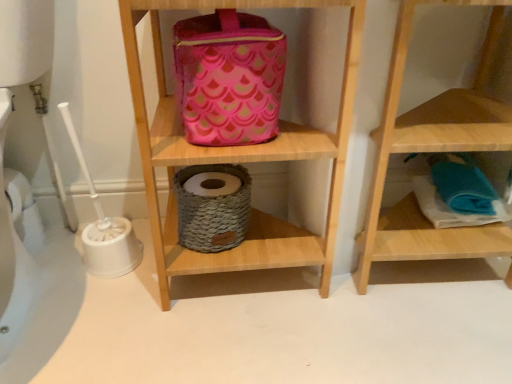
Question: Is pink fabric pouch at upper center closer to the viewer compared to pink fabric bag at upper center, arranged as the 1th shelf when viewed from the left?

Choices:
 (A) no
 (B) yes

Answer: (A)

Question: Is pink fabric pouch at upper center oriented towards pink fabric bag at upper center, the 2th shelf viewed from the right?

Choices:
 (A) yes
 (B) no

Answer: (A)

Question: Does pink fabric pouch at upper center have a larger size compared to pink fabric bag at upper center, arranged as the 1th shelf when viewed from the left?

Choices:
 (A) yes
 (B) no

Answer: (B)

Question: Is pink fabric pouch at upper center next to pink fabric bag at upper center, arranged as the 1th shelf when viewed from the left, and touching it?

Choices:
 (A) yes
 (B) no

Answer: (B)

Question: Is pink fabric pouch at upper center shorter than pink fabric bag at upper center, the 2th shelf viewed from the right?

Choices:
 (A) no
 (B) yes

Answer: (B)

Question: Considering the relative positions of pink fabric pouch at upper center and pink fabric bag at upper center, the 2th shelf viewed from the right, in the image provided, is pink fabric pouch at upper center to the left or to the right of pink fabric bag at upper center, the 2th shelf viewed from the right,?

Choices:
 (A) right
 (B) left

Answer: (B)

Question: Looking at the image, does pink fabric pouch at upper center seem bigger or smaller compared to pink fabric bag at upper center, the 2th shelf viewed from the right?

Choices:
 (A) big
 (B) small

Answer: (B)

Question: Is pink fabric pouch at upper center situated inside pink fabric bag at upper center, arranged as the 1th shelf when viewed from the left, or outside?

Choices:
 (A) outside
 (B) inside

Answer: (B)

Question: From the image's perspective, is pink fabric pouch at upper center positioned above or below pink fabric bag at upper center, arranged as the 1th shelf when viewed from the left?

Choices:
 (A) below
 (B) above

Answer: (B)

Question: Is point (372, 238) closer or farther from the camera than point (201, 16)?

Choices:
 (A) farther
 (B) closer

Answer: (A)

Question: Considering the positions of wooden towel at lower right, acting as the first shelf starting from the right, and pink fabric pouch at upper center in the image, is wooden towel at lower right, acting as the first shelf starting from the right, bigger or smaller than pink fabric pouch at upper center?

Choices:
 (A) small
 (B) big

Answer: (B)

Question: Would you say wooden towel at lower right, the second shelf from the left, is to the left or to the right of pink fabric pouch at upper center in the picture?

Choices:
 (A) right
 (B) left

Answer: (A)

Question: In terms of height, does wooden towel at lower right, acting as the first shelf starting from the right, look taller or shorter compared to pink fabric pouch at upper center?

Choices:
 (A) short
 (B) tall

Answer: (B)

Question: From their relative heights in the image, would you say pink fabric bag at upper center, the 2th shelf viewed from the right, is taller or shorter than pink fabric pouch at upper center?

Choices:
 (A) short
 (B) tall

Answer: (B)

Question: Choose the correct answer: Is pink fabric bag at upper center, the 2th shelf viewed from the right, inside pink fabric pouch at upper center or outside it?

Choices:
 (A) inside
 (B) outside

Answer: (B)